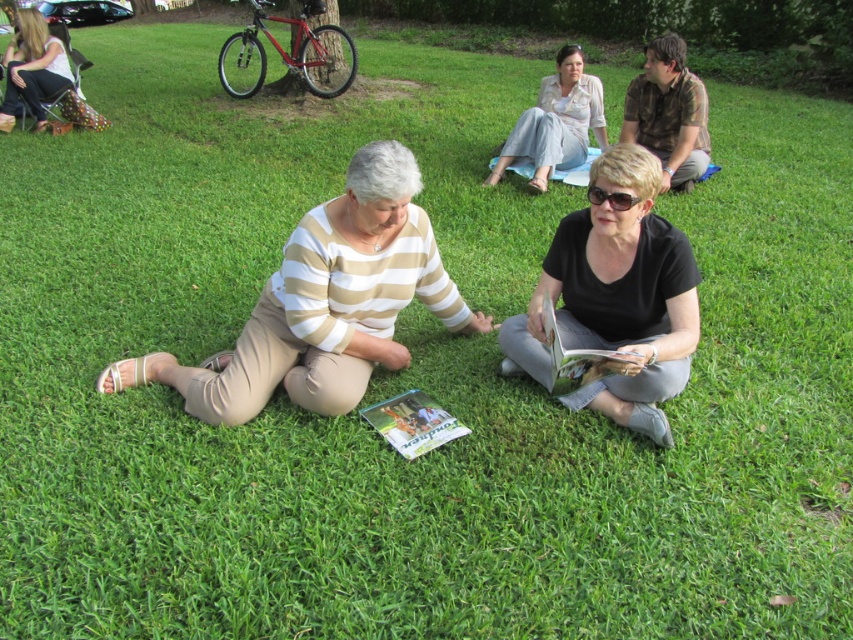
You are planning to place a small decorative item on the matte black boots at upper left. Considering the size of the matte green magazine at center, will the boots provide enough space for the item?

The matte black boots at upper left has a larger size compared to the matte green magazine at center, so it can accommodate the small decorative item since the boots are bigger than the magazine.

You are standing in a park and want to hand a leaflet to the person wearing the beige striped shirt at center. If you can reach up to 2 meters, will you be able to reach them without moving closer?

The beige striped shirt at center is 2.73 meters away from the viewer, which is beyond your 2 meter reach. You will need to move closer to hand the leaflet.

You are standing at the origin point in the image. A person wearing matte black boots at upper left is located at coordinate point (33, 70). If you want to move towards the matte black boots at upper left, which direction should you move?

The point (33, 70) where the matte black boots at upper left are located is to the upper left direction from the origin point. Therefore, you should move towards the upper left direction to reach the matte black boots at upper left.